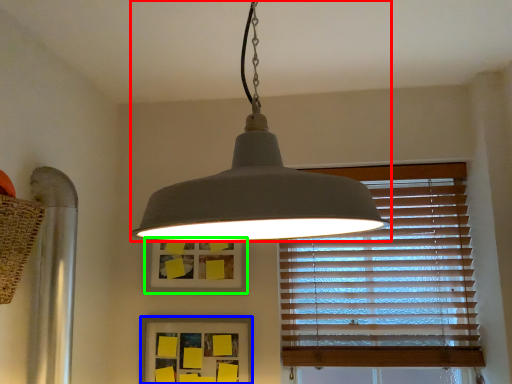
Question: Considering the real-world distances, which object is closest to lamp (highlighted by a red box)? picture frame (highlighted by a blue box) or picture frame (highlighted by a green box).

Choices:
 (A) picture frame
 (B) picture frame

Answer: (B)